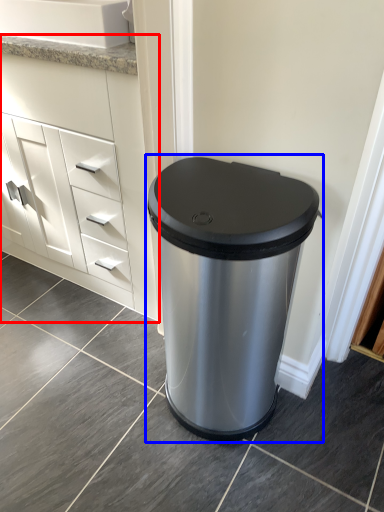
Question: Among these objects, which one is farthest to the camera, chest of drawers (highlighted by a red box) or waste container (highlighted by a blue box)?

Choices:
 (A) chest of drawers
 (B) waste container

Answer: (A)